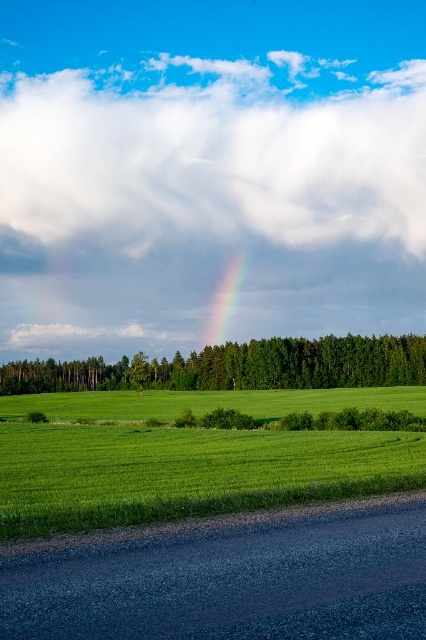
Question: Is white fluffy cloud at upper center bigger than green grassy field at center?

Choices:
 (A) yes
 (B) no

Answer: (A)

Question: Based on their relative distances, which object is nearer to the rainbow at center?

Choices:
 (A) green grassy field at center
 (B) green leafy tree at center

Answer: (B)

Question: Estimate the real-world distances between objects in this image. Which object is closer to the rainbow at center?

Choices:
 (A) green leafy tree at center
 (B) white fluffy cloud at upper center
 (C) green grassy field at center

Answer: (B)

Question: Does white fluffy cloud at upper center appear under green leafy tree at center?

Choices:
 (A) no
 (B) yes

Answer: (A)

Question: Considering the relative positions of white fluffy cloud at upper center and green grassy field at center in the image provided, where is white fluffy cloud at upper center located with respect to green grassy field at center?

Choices:
 (A) right
 (B) left

Answer: (B)

Question: Considering the real-world distances, which object is farthest from the green grassy field at center?

Choices:
 (A) green leafy tree at center
 (B) white fluffy cloud at upper center

Answer: (B)